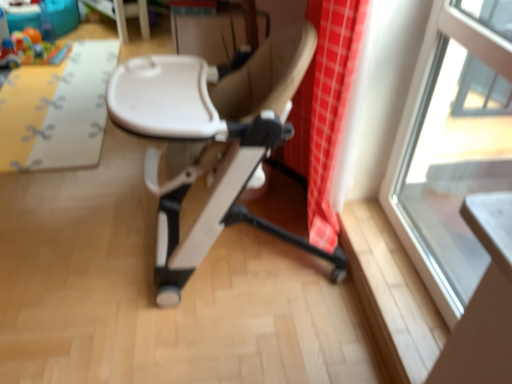
This screenshot has height=384, width=512. What are the coordinates of `blank area to the left of beige leather chair at center` in the screenshot? It's located at (83, 257).